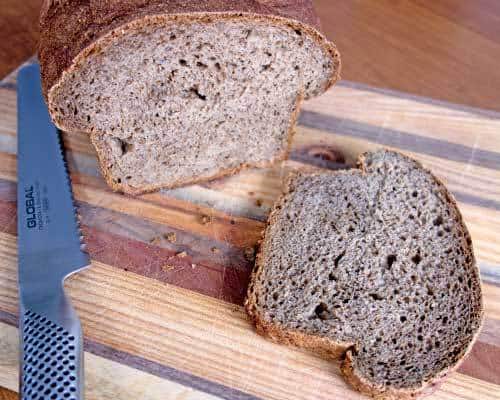
Where is `countertop`? This screenshot has width=500, height=400. countertop is located at coordinates (429, 45).